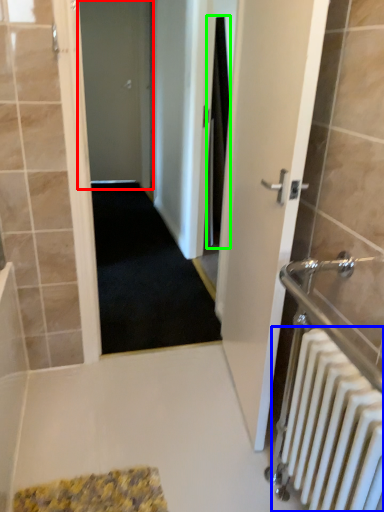
Question: Based on their relative distances, which object is nearer to door (highlighted by a red box)? Choose from radiator (highlighted by a blue box) and shower curtain (highlighted by a green box).

Choices:
 (A) radiator
 (B) shower curtain

Answer: (B)